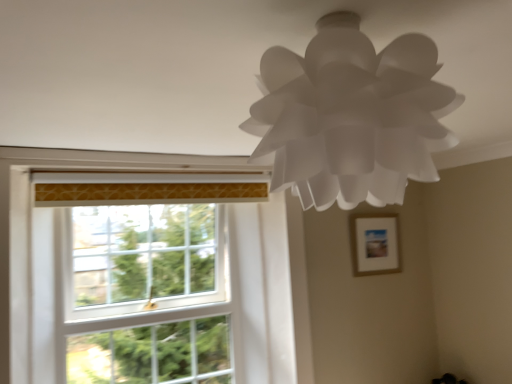
Question: Considering the positions of white glass window screen at left and white paper lamp at upper center in the image, is white glass window screen at left wider or thinner than white paper lamp at upper center?

Choices:
 (A) thin
 (B) wide

Answer: (A)

Question: Considering the relative positions of white glass window screen at left and white paper lamp at upper center in the image provided, is white glass window screen at left to the left or to the right of white paper lamp at upper center?

Choices:
 (A) left
 (B) right

Answer: (A)

Question: Which object is positioned closest to the white glass window screen at left?

Choices:
 (A) wooden picture frame at upper right
 (B) white paper lamp at upper center

Answer: (A)

Question: Which is farther from the white glass window screen at left?

Choices:
 (A) wooden picture frame at upper right
 (B) white paper lamp at upper center

Answer: (B)